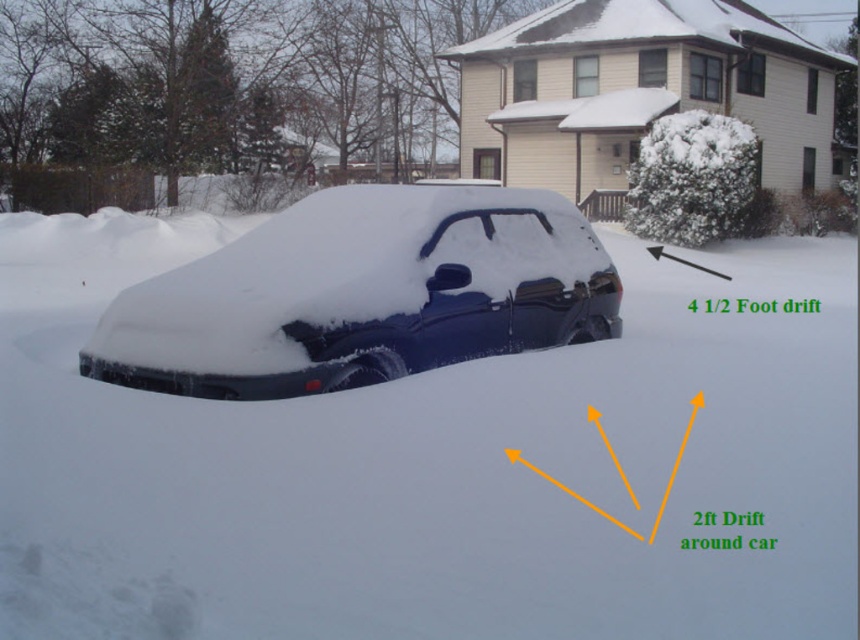
Looking at this image, measure the distance between point (822, 285) and camera.

Point (822, 285) is 17.48 meters from camera.

Where is `white fluffy snow at center`? The image size is (860, 640). white fluffy snow at center is located at coordinates (434, 467).